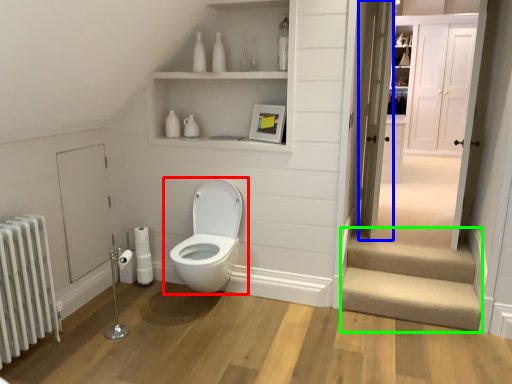
Question: Which is farther away from toilet (highlighted by a red box)? door (highlighted by a blue box) or stairwell (highlighted by a green box)?

Choices:
 (A) door
 (B) stairwell

Answer: (A)